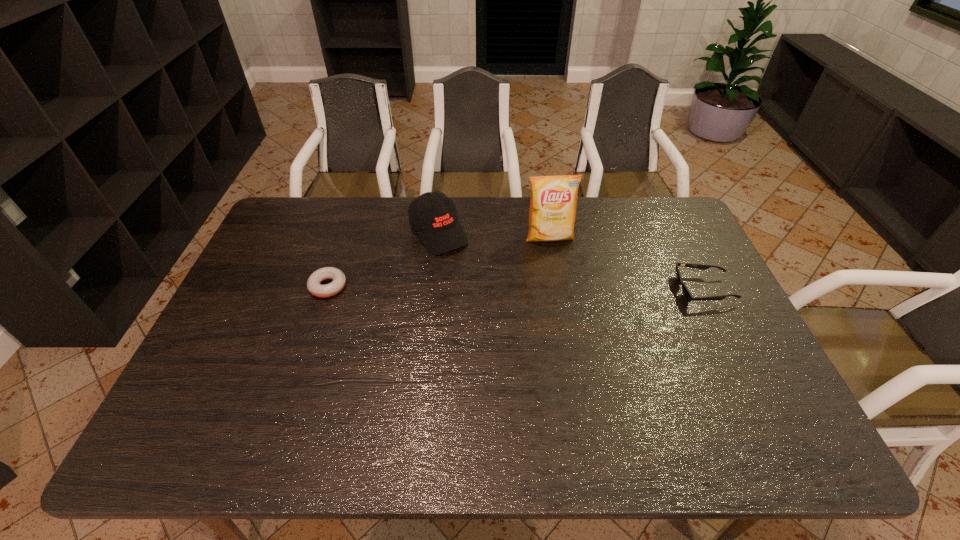
You are a GUI agent. You are given a task and a screenshot of the screen. Output one action in this format:
    pyautogui.click(x=<x>, y=<y>)
    Task: Click on the blank space located on the front-facing side of the rightmost object
    The image size is (960, 540).
    Given the screenshot: What is the action you would take?
    pyautogui.click(x=636, y=290)

The image size is (960, 540). I want to click on blank space located 0.350m on the front-facing side of the second object from left to right, so click(511, 327).

This screenshot has width=960, height=540. I want to click on vacant area located 0.350m on the front-facing side of the second object from left to right, so (x=511, y=327).

Image resolution: width=960 pixels, height=540 pixels. Identify the location of vacant region located on the front-facing side of the second object from left to right. pyautogui.click(x=490, y=301).

Find the location of a particular element. free spot located 0.050m on the front-facing side of the third object from left to right is located at coordinates (556, 258).

In order to click on vacant space located 0.400m on the front-facing side of the third object from left to right in this screenshot , I will do `click(582, 348)`.

The width and height of the screenshot is (960, 540). What are the coordinates of `vacant space located on the front-facing side of the third object from left to right` in the screenshot? It's located at (568, 302).

The image size is (960, 540). In order to click on baseball cap that is at the far edge in this screenshot , I will do `click(439, 229)`.

At what (x,y) coordinates should I click in order to perform the action: click on crisp (potato chip) present at the far edge. Please return your answer as a coordinate pair (x, y). This screenshot has width=960, height=540. Looking at the image, I should click on pyautogui.click(x=553, y=204).

Identify the location of object at the right edge. (688, 296).